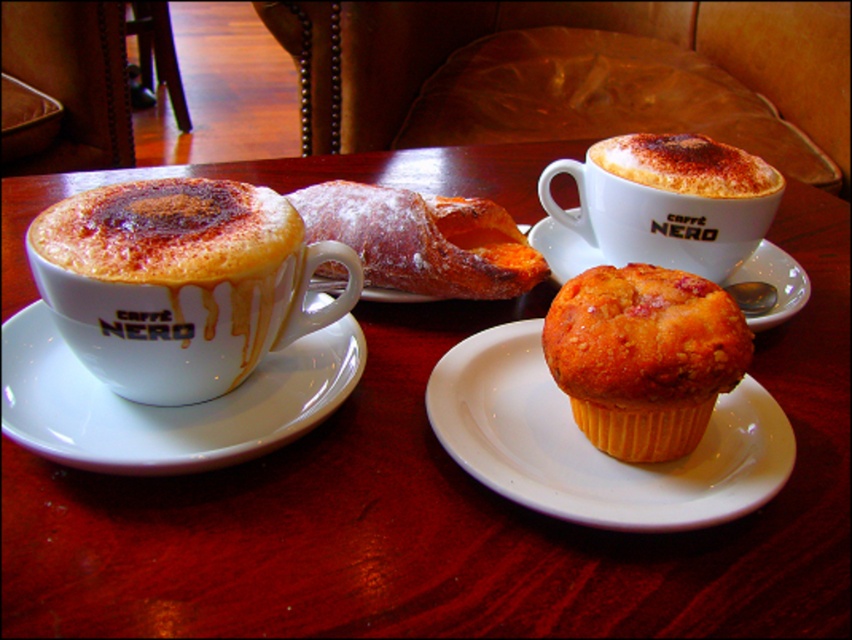
You are a barista trying to determine which item on the table is smaller in height between the cappuccino foam at upper center and the yellow paper muffin at center. Based on the description, which one is shorter?

The cappuccino foam at upper center is thinner than the yellow paper muffin at center, so the cappuccino foam at upper center is shorter in height.